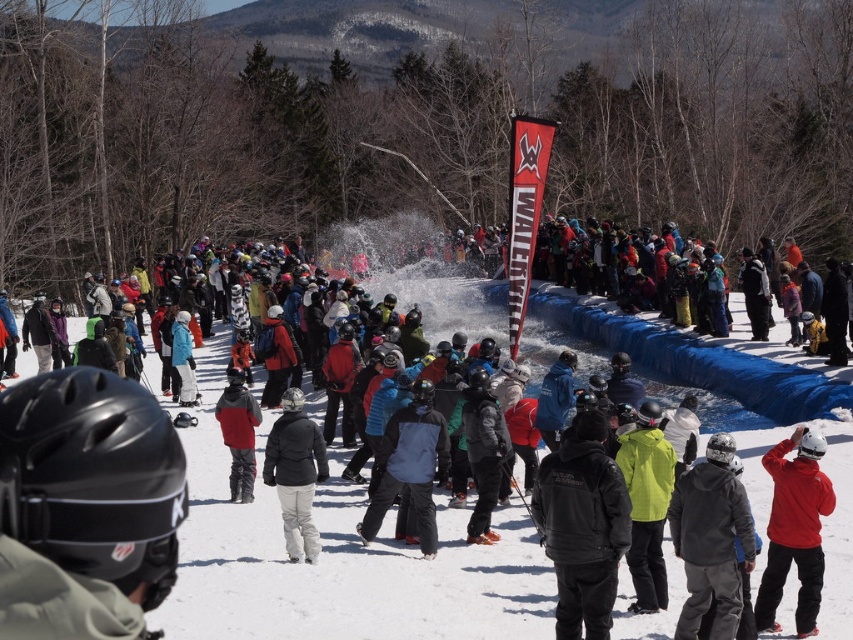
Question: Which object appears farthest from the camera in this image?

Choices:
 (A) red matte jacket at center
 (B) black leather jacket at center

Answer: (A)

Question: Estimate the real-world distances between objects in this image. Which object is closer to the red matte jacket at center?

Choices:
 (A) red jacket at center
 (B) black leather jacket at center

Answer: (B)

Question: In this image, where is blue tarp at center located relative to black matte jacket at center?

Choices:
 (A) above
 (B) below

Answer: (A)

Question: Which point appears closest to the camera in this image?

Choices:
 (A) (817, 588)
 (B) (524, 621)
 (C) (312, 540)
 (D) (583, 419)

Answer: (D)

Question: From the image, what is the correct spatial relationship of black leather jacket at center in relation to red jacket at center?

Choices:
 (A) above
 (B) below

Answer: (B)

Question: Does blue tarp at center appear on the right side of black leather jacket at center?

Choices:
 (A) no
 (B) yes

Answer: (A)